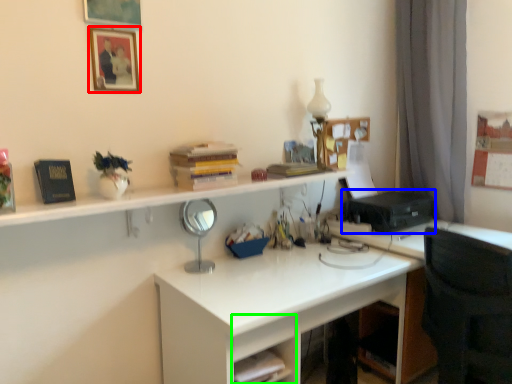
Question: Considering the real-world distances, which object is closest to picture frame (highlighted by a red box)? printer (highlighted by a blue box) or drawer (highlighted by a green box).

Choices:
 (A) printer
 (B) drawer

Answer: (B)